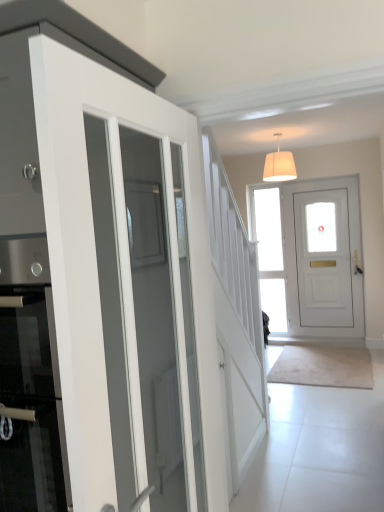
Question: Is white glossy door at left, which ranks as the 2th door in back-to-front order, not close to white matte door at center, the second door from the left?

Choices:
 (A) no
 (B) yes

Answer: (B)

Question: From the image's perspective, does white glossy door at left, which is the 1th door from left to right, appear higher than white matte door at center, the second door positioned from the front?

Choices:
 (A) no
 (B) yes

Answer: (A)

Question: Considering the relative positions of white glossy door at left, which is the 1th door from left to right, and white matte door at center, the 1th door viewed from the back, in the image provided, is white glossy door at left, which is the 1th door from left to right, to the right of white matte door at center, the 1th door viewed from the back, from the viewer's perspective?

Choices:
 (A) yes
 (B) no

Answer: (B)

Question: From the image's perspective, would you say white glossy door at left, which ranks as the 2th door in back-to-front order, is shown under white matte door at center, the second door positioned from the front?

Choices:
 (A) yes
 (B) no

Answer: (A)

Question: From a real-world perspective, is white glossy door at left, arranged as the first door when viewed from the front, located higher than white matte door at center, the 1th door viewed from the back?

Choices:
 (A) yes
 (B) no

Answer: (A)

Question: From their relative heights in the image, would you say clear glass door at center is taller or shorter than white glossy door at left, marked as the second door in a right-to-left arrangement?

Choices:
 (A) short
 (B) tall

Answer: (B)

Question: In the image, is clear glass door at center positioned in front of or behind white glossy door at left, which is the 1th door from left to right?

Choices:
 (A) behind
 (B) front

Answer: (A)

Question: Considering the positions of clear glass door at center and white glossy door at left, marked as the second door in a right-to-left arrangement, in the image, is clear glass door at center wider or thinner than white glossy door at left, marked as the second door in a right-to-left arrangement,?

Choices:
 (A) wide
 (B) thin

Answer: (B)

Question: Does point (259, 278) appear closer or farther from the camera than point (89, 303)?

Choices:
 (A) farther
 (B) closer

Answer: (A)

Question: Is point (91, 292) positioned closer to the camera than point (291, 178)?

Choices:
 (A) closer
 (B) farther

Answer: (A)

Question: Looking at the image, does white glossy door at left, arranged as the first door when viewed from the front, seem bigger or smaller compared to white fabric lampshade at upper center?

Choices:
 (A) small
 (B) big

Answer: (B)

Question: Would you say white glossy door at left, arranged as the first door when viewed from the front, is to the left or to the right of white fabric lampshade at upper center in the picture?

Choices:
 (A) left
 (B) right

Answer: (A)

Question: Is white glossy door at left, marked as the second door in a right-to-left arrangement, in front of or behind white fabric lampshade at upper center in the image?

Choices:
 (A) front
 (B) behind

Answer: (A)

Question: Looking at their shapes, would you say white matte door at center, the second door positioned from the front, is wider or thinner than white glossy door at left, marked as the second door in a right-to-left arrangement?

Choices:
 (A) thin
 (B) wide

Answer: (B)

Question: From the image's perspective, is white matte door at center, the second door from the left, positioned above or below white glossy door at left, which ranks as the 2th door in back-to-front order?

Choices:
 (A) above
 (B) below

Answer: (A)